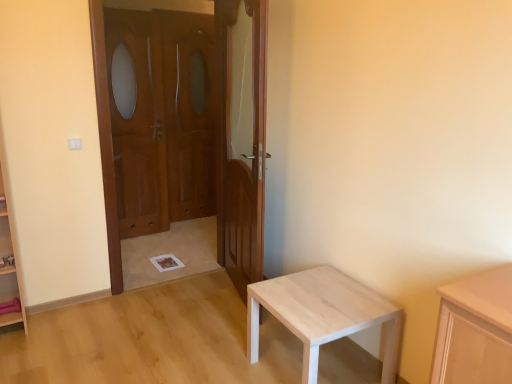
At what (x,y) coordinates should I click in order to perform the action: click on vacant space behind wooden door at left, placed as the second door when sorted from right to left. Please return your answer as a coordinate pair (x, y). This screenshot has height=384, width=512. Looking at the image, I should click on (179, 256).